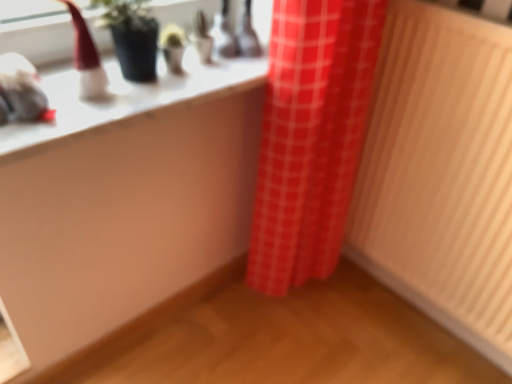
Find the location of a particular element. vacant point to the left of wooden radiator at right is located at coordinates (311, 336).